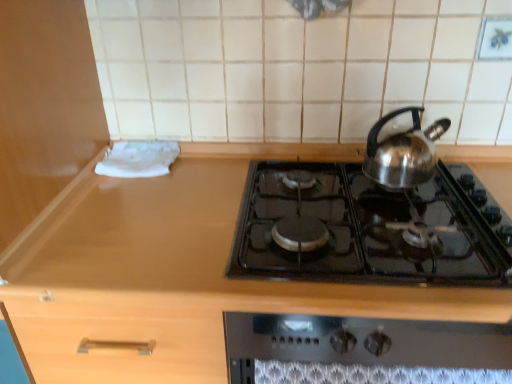
Identify the location of vacant space in front of shiny metallic kettle at upper right. The image size is (512, 384). (428, 236).